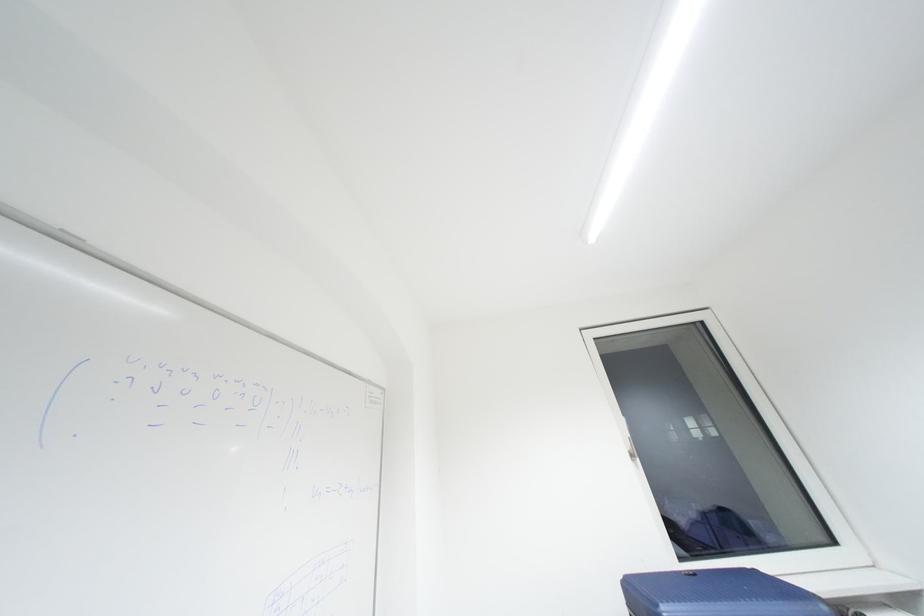
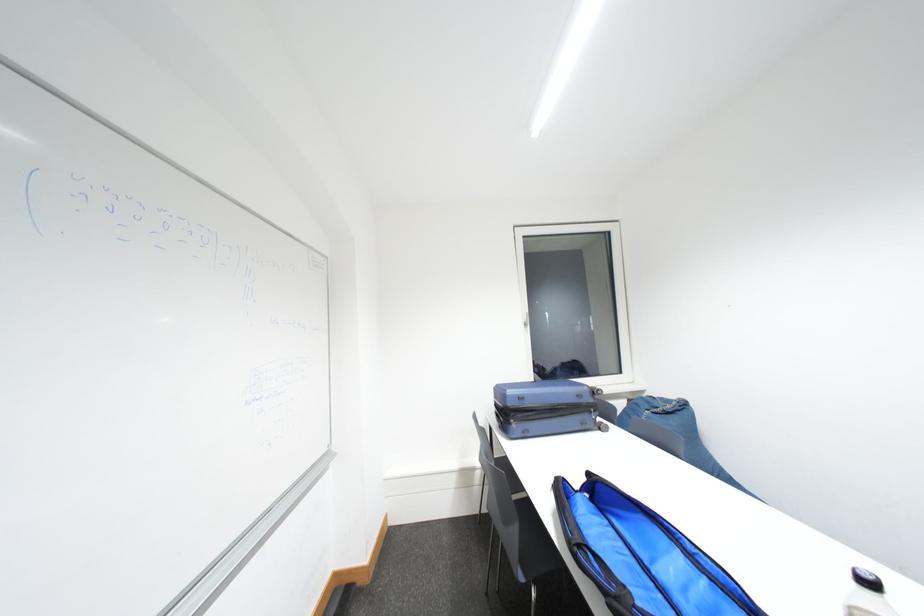
Question: How did the camera likely rotate?

Choices:
 (A) Left
 (B) Right
 (C) Up
 (D) Down

Answer: (D)